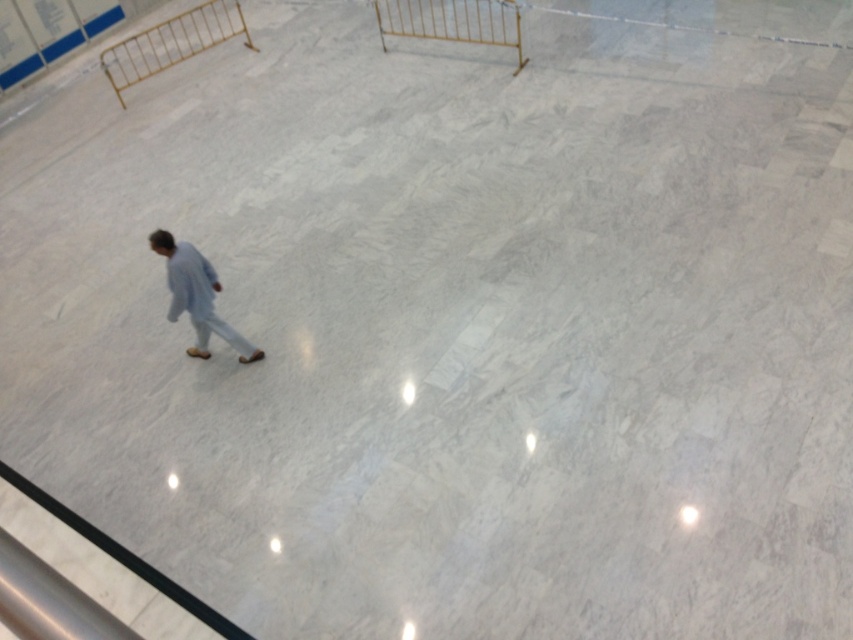
You are standing at the entrance of the indoor space and want to walk towards the gold metallic rail at upper center. Which direction should you move relative to the gold metallic rail at upper left?

The gold metallic rail at upper left is positioned on the left side of the gold metallic rail at upper center. To reach the gold metallic rail at upper center, you should move to the right from the gold metallic rail at upper left.

You are standing at the center of the marble floor and want to walk towards the gold metallic rail at upper left. Which direction should you head?

The gold metallic rail at upper left is located at coordinates [171,42], so you should head towards the upper left direction to reach it.

You are standing at the entrance of a marble floored indoor area and see the gold metallic rail at upper left and the light blue fabric at center. Which object would you estimate to be bigger in size?

The gold metallic rail at upper left is larger in size compared to the light blue fabric at center.